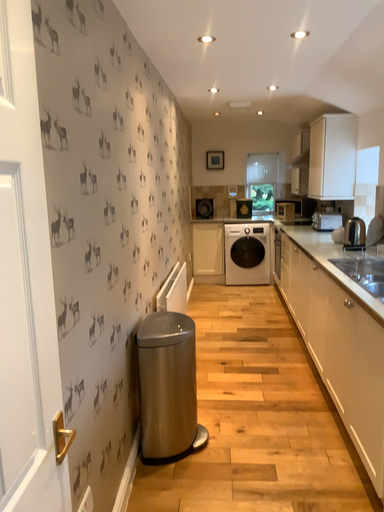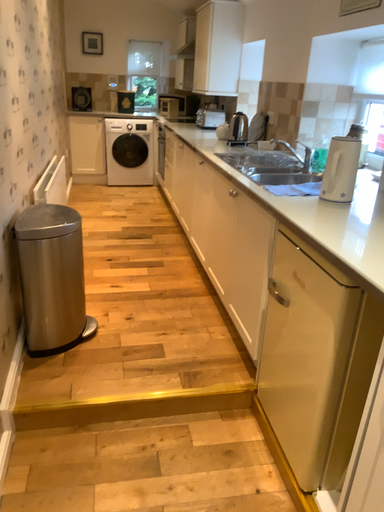
Question: Which way did the camera rotate in the video?

Choices:
 (A) rotated upward
 (B) rotated downward

Answer: (B)